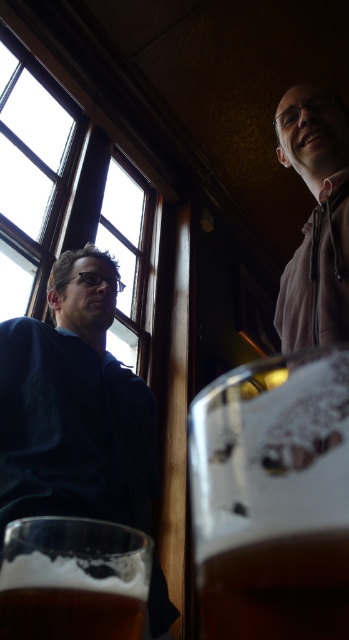
Question: Which of the following is the farthest from the observer?

Choices:
 (A) brown frothy beer at lower center
 (B) foamy amber glass at lower right
 (C) gray hoodie at upper right
 (D) translucent frosted glass at lower left

Answer: (C)

Question: Among these points, which one is nearest to the camera?

Choices:
 (A) (12, 518)
 (B) (123, 208)

Answer: (A)

Question: Does translucent frosted glass at lower left appear over brown frothy beer at lower center?

Choices:
 (A) no
 (B) yes

Answer: (A)

Question: Which point is farther to the camera?

Choices:
 (A) foamy amber glass at lower right
 (B) translucent frosted glass at lower left
 (C) dark blue shirt at left
 (D) gray hoodie at upper right

Answer: (C)

Question: Does translucent frosted glass at lower left lie in front of gray hoodie at upper right?

Choices:
 (A) yes
 (B) no

Answer: (A)

Question: Is wooden frame window at left above gray hoodie at upper right?

Choices:
 (A) no
 (B) yes

Answer: (B)